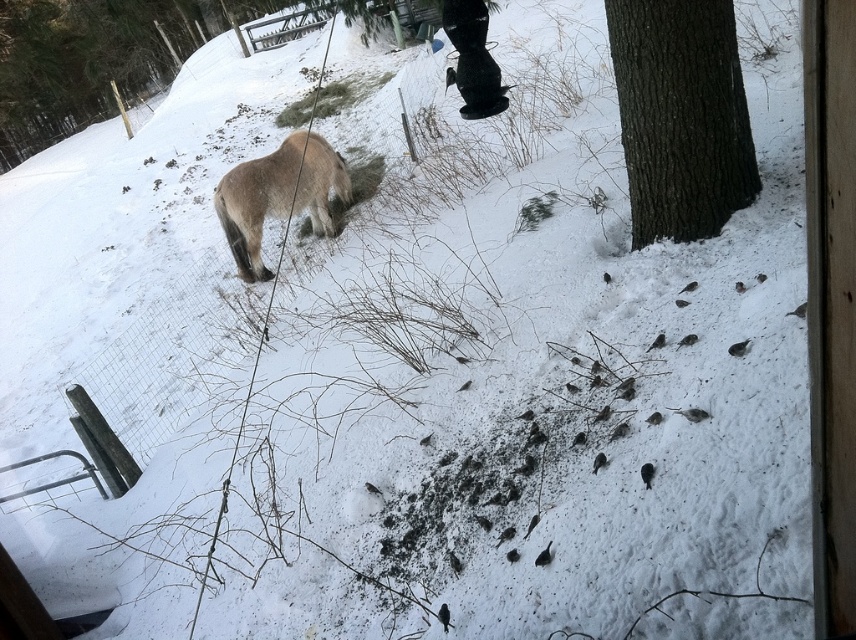
Is dark brown bark at right above fuzzy brown pony at upper left?

No.

Is point (687, 164) positioned before point (310, 170)?

Yes.

Identify the location of dark brown bark at right. (681, 116).